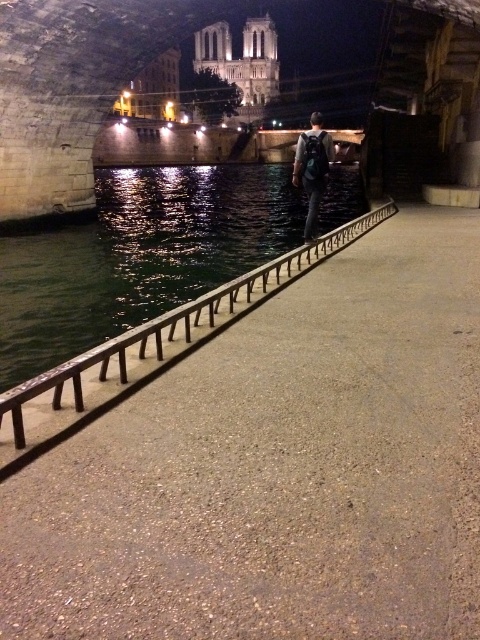
Question: Does black metal rail at center have a greater width compared to dark blue backpack at center?

Choices:
 (A) no
 (B) yes

Answer: (A)

Question: Among these objects, which one is nearest to the camera?

Choices:
 (A) black metal rail at center
 (B) dark blue backpack at center

Answer: (A)

Question: Which of the following is the farthest from the observer?

Choices:
 (A) black metal rail at center
 (B) dark blue backpack at center

Answer: (B)

Question: Is the position of black metal rail at center less distant than that of dark blue backpack at center?

Choices:
 (A) no
 (B) yes

Answer: (B)

Question: Is black metal rail at center below dark blue backpack at center?

Choices:
 (A) yes
 (B) no

Answer: (A)

Question: Among these points, which one is nearest to the camera?

Choices:
 (A) (313, 232)
 (B) (271, 276)

Answer: (B)